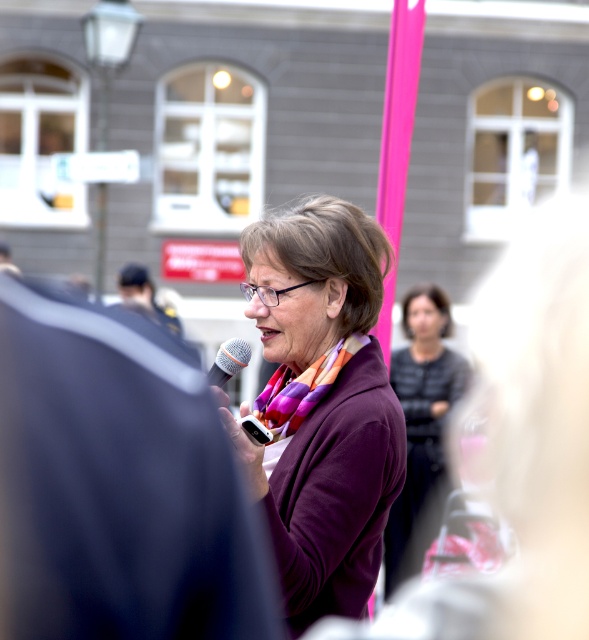
Question: Which object is closer to the camera taking this photo?

Choices:
 (A) multicolored woven scarf at center
 (B) silver metallic microphone at center

Answer: (A)

Question: Observing the image, what is the correct spatial positioning of purple soft sweater at center in reference to multicolored woven scarf at center?

Choices:
 (A) right
 (B) left

Answer: (B)

Question: Which point is farther to the camera?

Choices:
 (A) (378, 356)
 (B) (296, 387)

Answer: (A)

Question: Among these points, which one is farthest from the camera?

Choices:
 (A) (326, 360)
 (B) (422, 337)

Answer: (B)

Question: Can you confirm if multicolored woven scarf at center is wider than silver metallic microphone at center?

Choices:
 (A) yes
 (B) no

Answer: (A)

Question: Is purple soft sweater at center in front of purple fabric scarf at center?

Choices:
 (A) no
 (B) yes

Answer: (B)